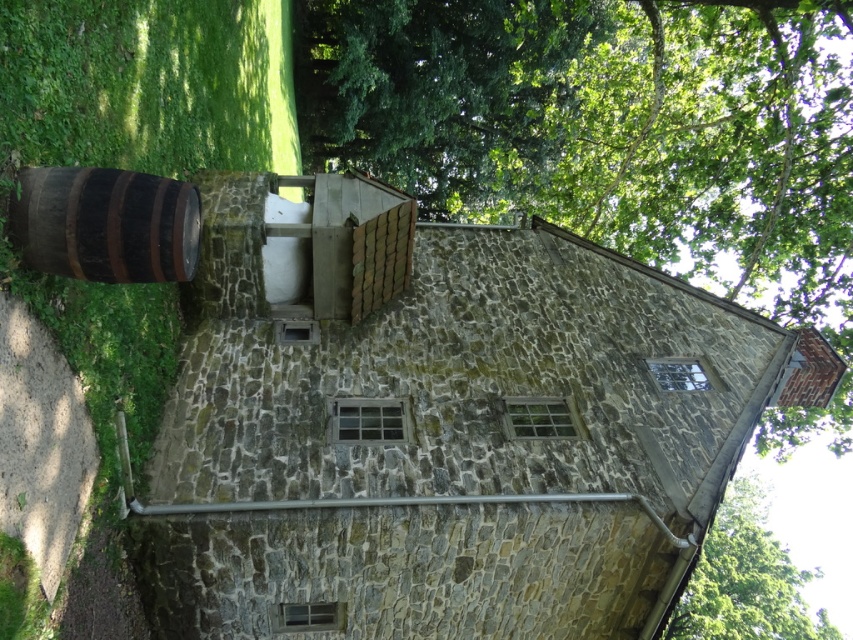
Question: Is rustic wooden barrel at left further to camera compared to green leafy tree at upper right?

Choices:
 (A) yes
 (B) no

Answer: (B)

Question: Among these objects, which one is farthest from the camera?

Choices:
 (A) green leafy tree at upper right
 (B) brown wooden barrel at left

Answer: (A)

Question: Is brown wooden barrel at left wider than green leafy tree at upper right?

Choices:
 (A) yes
 (B) no

Answer: (B)

Question: Which point is farther from the camera taking this photo?

Choices:
 (A) (675, 230)
 (B) (18, 232)
 (C) (723, 538)

Answer: (C)

Question: Which of these objects is positioned farthest from the green leafy tree at center?

Choices:
 (A) green leafy tree at upper right
 (B) brown wooden barrel at left
 (C) rustic wooden barrel at left

Answer: (C)

Question: Can you confirm if brown wooden barrel at left is smaller than rustic wooden barrel at left?

Choices:
 (A) no
 (B) yes

Answer: (A)